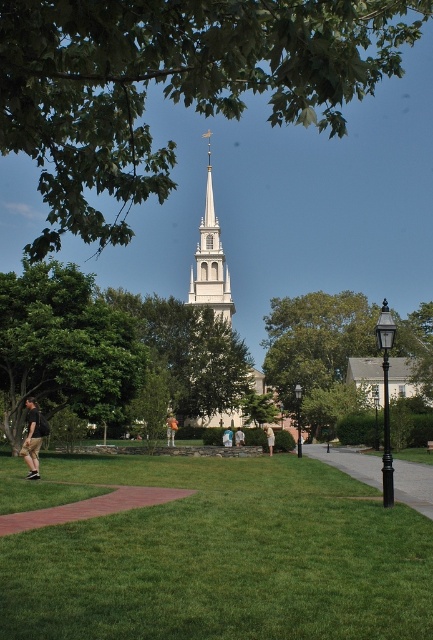
You are standing at the center of the image and want to walk to the red brick path at lower left. Which direction should you move in order to reach it?

Since the red brick path at lower left is located at coordinates point (90, 508), you should move towards the lower left direction to reach it.

You are standing at the point labeled point (103, 614) and want to walk to point (268, 442). Which direction should you move to get closer to your destination?

You should move towards the upper right direction since point (103, 614) is closer to the viewer than point (268, 442), meaning the destination is further back in the scene.

Based on the photo, you are standing at the entrance of the park and see the green leafy tree at upper center and the light blue fabric shirt at center. Which object is closer to the right side of the image?

The light blue fabric shirt at center is closer to the right side of the image because the green leafy tree at upper center is to its left.